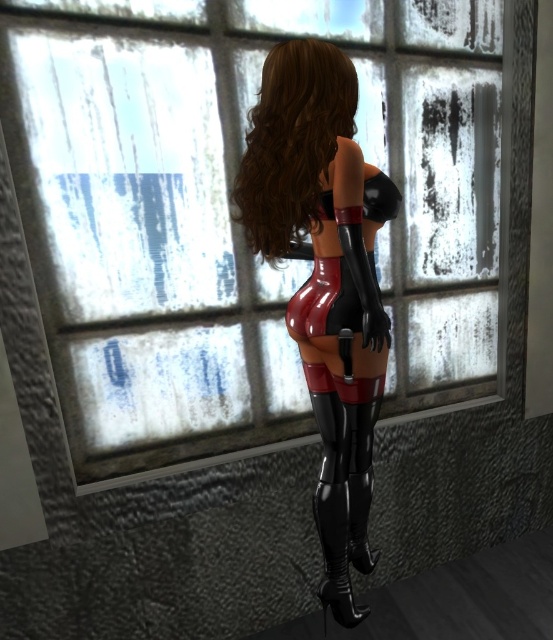
Question: Does shiny brown hair at center appear on the left side of black patent leather boot at lower center?

Choices:
 (A) yes
 (B) no

Answer: (A)

Question: Which object is the closest to the black patent leather boot at lower center?

Choices:
 (A) glossy latex outfit at center
 (B) shiny brown hair at center
 (C) clear glass window at center
 (D) glossy red dress at center

Answer: (A)

Question: In this image, where is clear glass window at center located relative to glossy red dress at center?

Choices:
 (A) right
 (B) left

Answer: (B)

Question: Does clear glass window at center appear on the right side of shiny brown hair at center?

Choices:
 (A) yes
 (B) no

Answer: (A)

Question: Considering the real-world distances, which object is closest to the black patent leather boot at lower center?

Choices:
 (A) glossy red dress at center
 (B) shiny brown hair at center
 (C) glossy latex outfit at center
 (D) clear glass window at center

Answer: (C)

Question: Which of the following is the farthest from the observer?

Choices:
 (A) shiny brown hair at center
 (B) clear glass window at center
 (C) black patent leather boot at lower center
 (D) glossy red dress at center

Answer: (C)